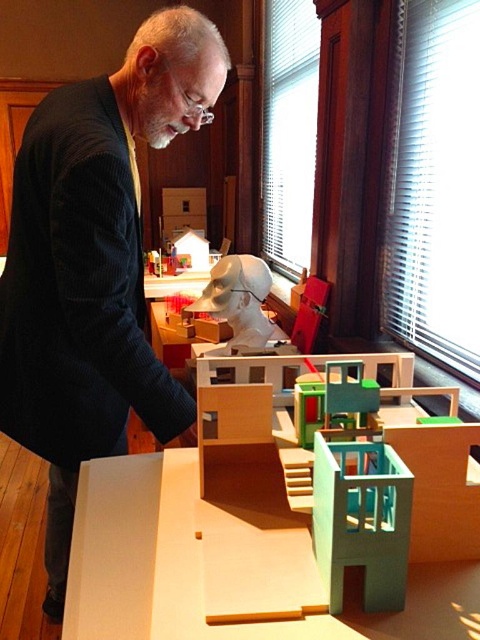
Question: Does dark corduroy jacket at left have a smaller size compared to white matte sculpture at center?

Choices:
 (A) yes
 (B) no

Answer: (B)

Question: Which object is positioned closest to the dark corduroy jacket at left?

Choices:
 (A) white matte sculpture at center
 (B) light blue plastic building at lower right
 (C) peach wood table at center

Answer: (C)

Question: Which point is farther from the camera taking this photo?

Choices:
 (A) (99, 305)
 (B) (407, 554)

Answer: (A)

Question: In this image, where is light blue plastic building at lower right located relative to white matte sculpture at center?

Choices:
 (A) left
 (B) right

Answer: (B)

Question: Which object appears closest to the camera in this image?

Choices:
 (A) dark corduroy jacket at left
 (B) light blue plastic building at lower right

Answer: (B)

Question: Is dark corduroy jacket at left positioned at the back of light blue plastic building at lower right?

Choices:
 (A) yes
 (B) no

Answer: (A)